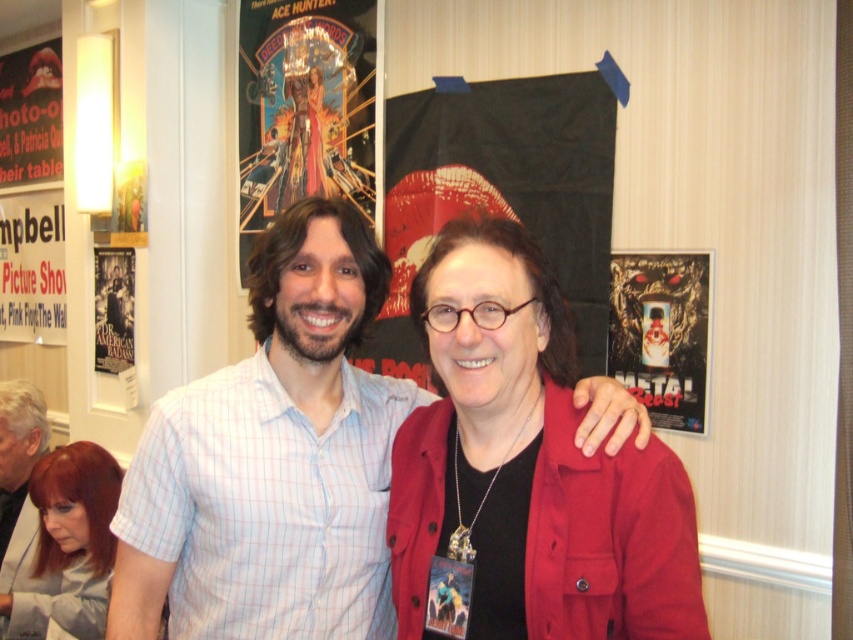
Question: Which point is closer to the camera?

Choices:
 (A) white paper poster at left
 (B) gray hair at lower left
 (C) red glossy poster at upper left
 (D) metallic poster at upper center

Answer: (B)

Question: Which point is farther from the camera taking this photo?

Choices:
 (A) (645, 403)
 (B) (4, 605)

Answer: (A)

Question: From the image, what is the correct spatial relationship of matte red jacket at center in relation to white paper poster at left?

Choices:
 (A) above
 (B) below

Answer: (B)

Question: Is metallic poster at upper center to the right of white paper poster at left from the viewer's perspective?

Choices:
 (A) yes
 (B) no

Answer: (A)

Question: Where is metallic silver poster at upper right located in relation to matte black poster at left in the image?

Choices:
 (A) left
 (B) right

Answer: (B)

Question: Which of these objects is positioned farthest from the white checkered shirt at center?

Choices:
 (A) metallic poster at upper center
 (B) matte red jacket at center
 (C) metallic silver poster at upper right

Answer: (A)